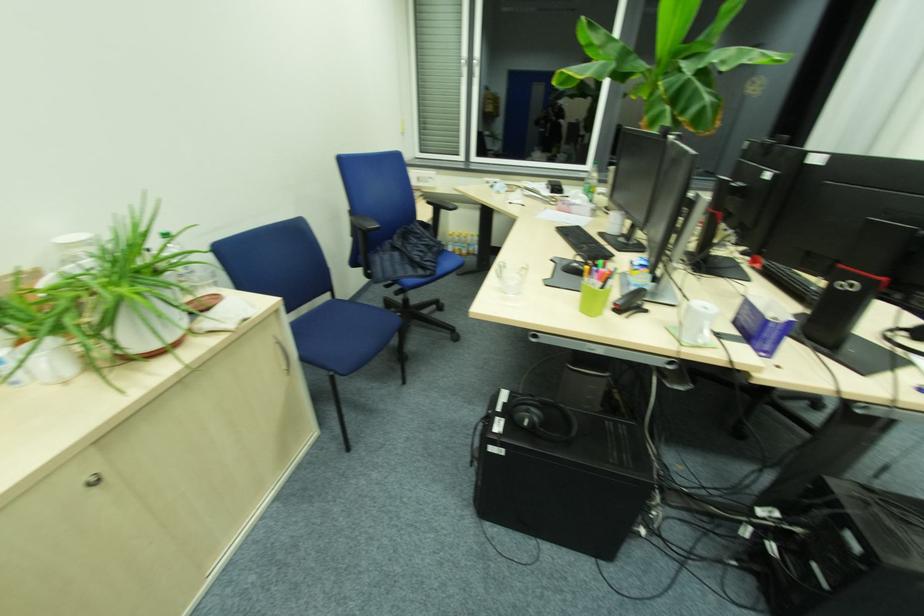
Describe the element at coordinates (284, 354) in the screenshot. I see `a curved cabinet handle` at that location.